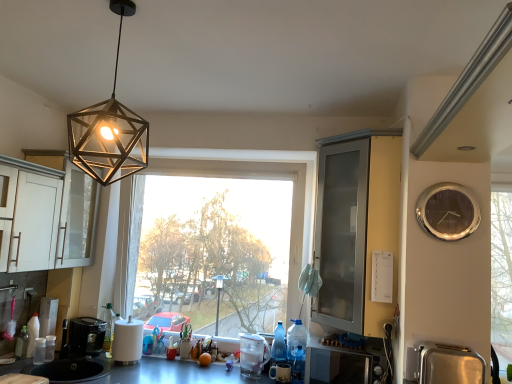
Identify the location of free location to the right of white matte paper towel holder at center, the fourth appliance when ordered from front to back. Image resolution: width=512 pixels, height=384 pixels. (157, 365).